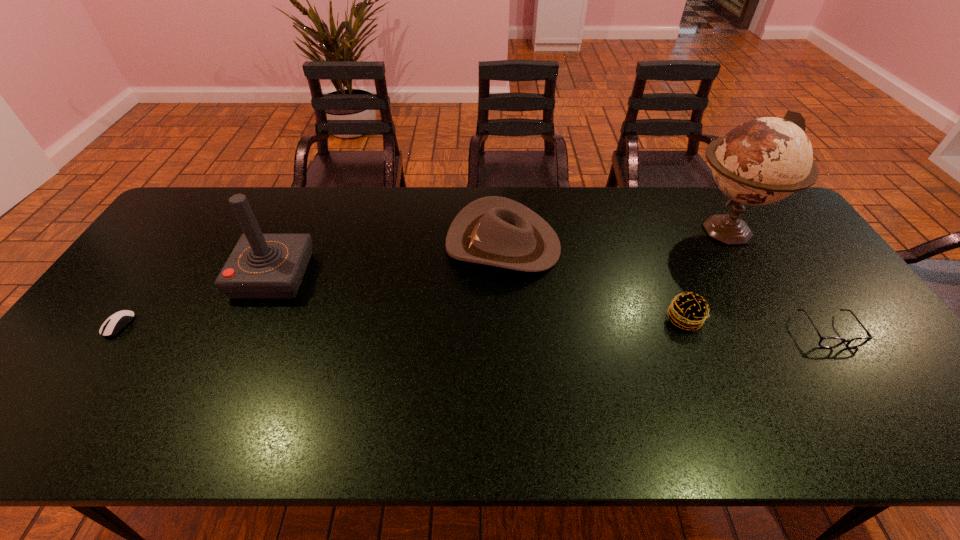
You are a GUI agent. You are given a task and a screenshot of the screen. Output one action in this format:
    pyautogui.click(x=<x>, y=<y>)
    Task: Click on the tallest object
    The height and width of the screenshot is (540, 960).
    Given the screenshot: What is the action you would take?
    pyautogui.click(x=762, y=161)

The width and height of the screenshot is (960, 540). In order to click on the fifth object from right to left in this screenshot , I will do `click(261, 266)`.

At what (x,y) coordinates should I click in order to perform the action: click on the fifth shortest object. Please return your answer as a coordinate pair (x, y). The image size is (960, 540). Looking at the image, I should click on (261, 266).

You are a GUI agent. You are given a task and a screenshot of the screen. Output one action in this format:
    pyautogui.click(x=<x>, y=<y>)
    Task: Click on the third tallest object
    
    Given the screenshot: What is the action you would take?
    pyautogui.click(x=497, y=231)

The height and width of the screenshot is (540, 960). In order to click on cowboy hat in this screenshot , I will do `click(497, 231)`.

The width and height of the screenshot is (960, 540). I want to click on the third shortest object, so click(x=688, y=310).

You are a GUI agent. You are given a task and a screenshot of the screen. Output one action in this format:
    pyautogui.click(x=<x>, y=<y>)
    Task: Click on the patty
    This screenshot has height=540, width=960.
    Given the screenshot: What is the action you would take?
    pyautogui.click(x=688, y=310)

This screenshot has width=960, height=540. What are the coordinates of `spectacles` in the screenshot? It's located at (826, 342).

Locate an element on the screen. Image resolution: width=960 pixels, height=540 pixels. the leftmost object is located at coordinates (117, 321).

Where is `mouse`? The image size is (960, 540). mouse is located at coordinates (117, 321).